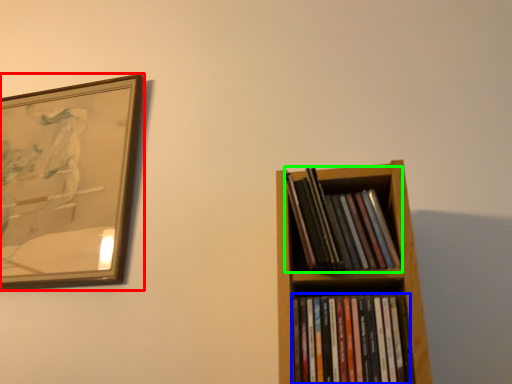
Question: Which object is the farthest from picture frame (highlighted by a red box)? Choose among these: book (highlighted by a blue box) or book (highlighted by a green box).

Choices:
 (A) book
 (B) book

Answer: (A)